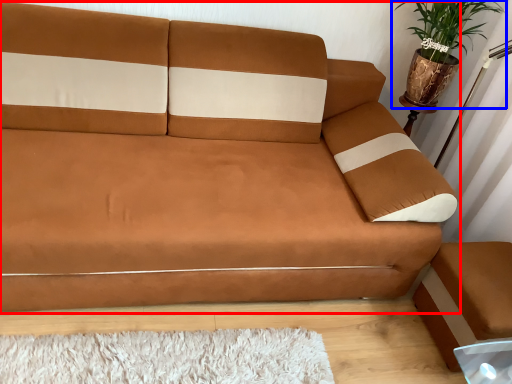
Question: Among these objects, which one is farthest to the camera, studio couch (highlighted by a red box) or houseplant (highlighted by a blue box)?

Choices:
 (A) studio couch
 (B) houseplant

Answer: (B)